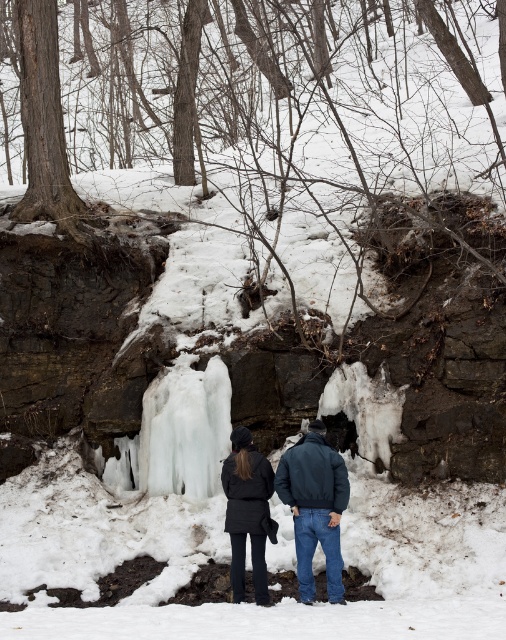
Who is more distant from viewer, (185, 410) or (339, 534)?

The point (185, 410) is more distant.

Who is more forward, (178, 440) or (301, 456)?

Point (301, 456) is more forward.

The image size is (506, 640). What are the coordinates of `icy translucent waterfall at center` in the screenshot? It's located at (177, 435).

Is point (331, 540) positioned after point (237, 541)?

No, it is not.

Is dark blue jacket at center positioned at the back of dark gray matte jacket at center?

No, dark blue jacket at center is closer to the viewer.

Which is behind, point (338, 570) or point (228, 493)?

The point (228, 493) is more distant.

The height and width of the screenshot is (640, 506). I want to click on dark blue jacket at center, so click(317, 506).

Is icy translucent waterfall at center smaller than dark gray matte jacket at center?

Actually, icy translucent waterfall at center might be larger than dark gray matte jacket at center.

Image resolution: width=506 pixels, height=640 pixels. In order to click on icy translucent waterfall at center in this screenshot , I will do `click(177, 435)`.

Describe the element at coordinates (177, 435) in the screenshot. This screenshot has height=640, width=506. I see `icy translucent waterfall at center` at that location.

Find the location of a particular element. icy translucent waterfall at center is located at coordinates [177, 435].